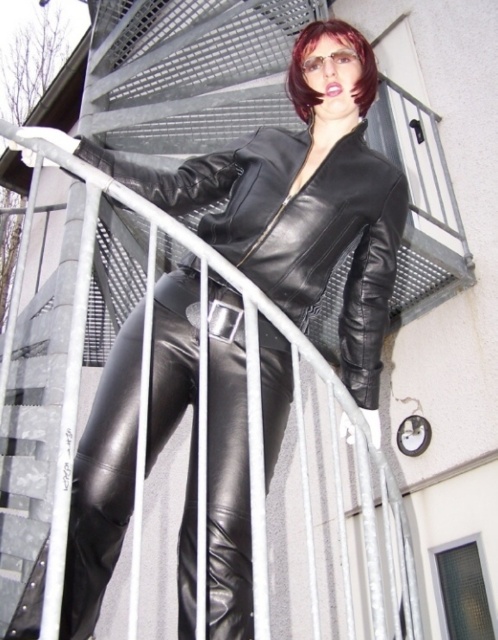
You are a delivery robot that needs to deliver a package to the person standing on the spiral staircase. The package is 1.8 meters long. Can you safely place the package between the black leather boot at lower left and the shiny dark brown hair at center without it overlapping either?

The distance between the black leather boot at lower left and the shiny dark brown hair at center is 1.72 meters. Since the package is 1.8 meters long, it cannot be placed between them without overlapping either object.

You are a fashion designer observing the person in the image. You need to determine if the black leather jacket at center can be replaced with a smaller jacket without affecting the visibility of the shiny dark brown hair at center. Can this be done?

The black leather jacket at center is larger in size than the shiny dark brown hair at center. Since the jacket is larger, replacing it with a smaller jacket would likely allow the shiny dark brown hair at center to remain visible as it is smaller in size and positioned at the same central area.

Consider the image. You are a photographer trying to capture the person in the image. The black leather boot at lower left and the shiny dark brown hair at center are both in your viewfinder. Which object is located more to the left?

The black leather boot at lower left is more to the left than the shiny dark brown hair at center.